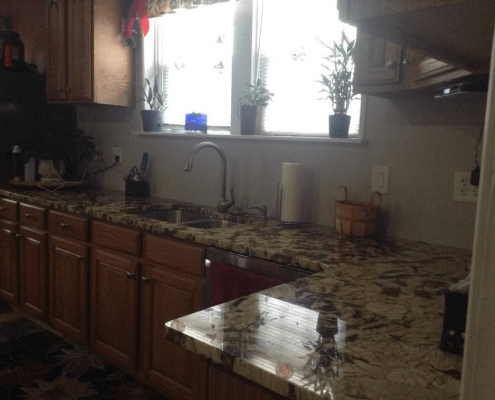
The width and height of the screenshot is (495, 400). Find the location of `handle`. handle is located at coordinates (63, 227), (28, 216).